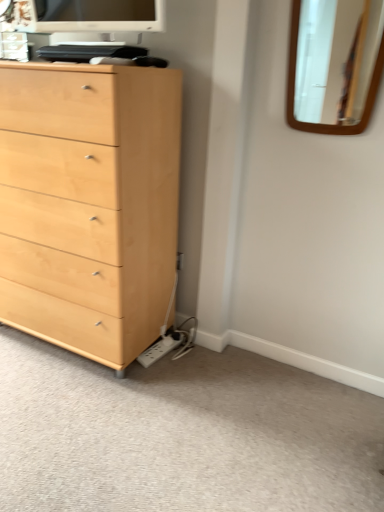
Image resolution: width=384 pixels, height=512 pixels. What are the coordinates of `free space in front of light wood chest of drawers at left` in the screenshot? It's located at (74, 412).